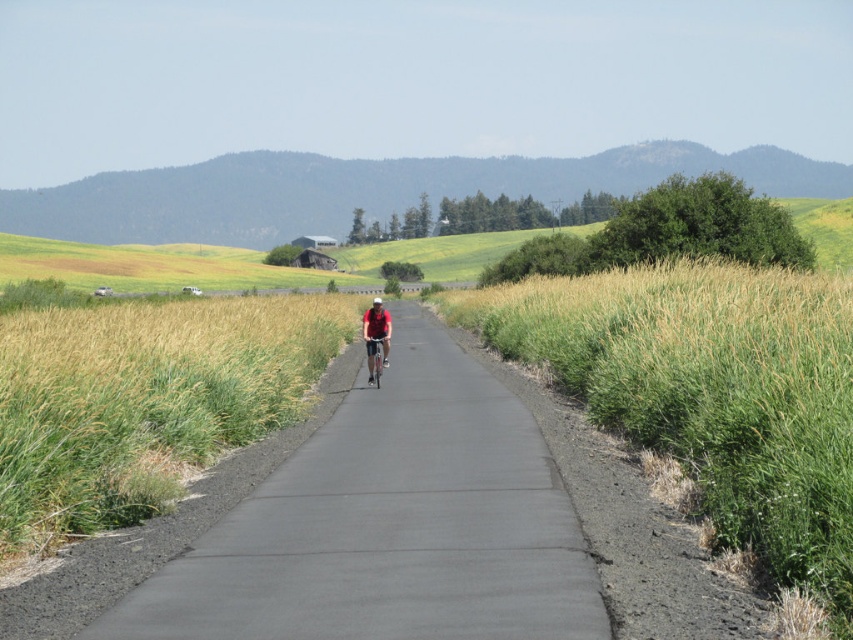
You are a drone operator trying to capture aerial footage of the black asphalt road at center and the green grass at center. Which object will appear taller in the footage?

The green grass at center appears taller than the black asphalt road at center in the footage because the green grass at center is taller than the black asphalt road at center.

You are a hiker walking along the paved path in the rural scene. You notice the green grass at center and the red matte shirt at center. Which object is located to the left of the other?

The green grass at center is positioned on the left side of the red matte shirt at center.